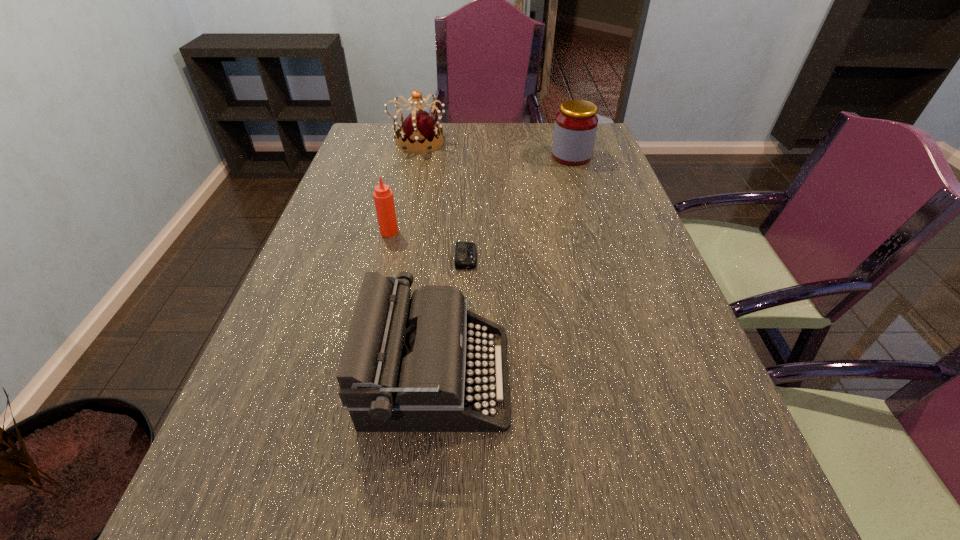
Locate an element on the screen. This screenshot has height=540, width=960. vacant position in the image that satisfies the following two spatial constraints: 1. on the front-facing side of the rightmost object; 2. on the right side of the tiara is located at coordinates (415, 157).

Find the location of a particular element. vacant space that satisfies the following two spatial constraints: 1. on the back side of the Tabasco sauce; 2. on the left side of the rightmost object is located at coordinates (408, 157).